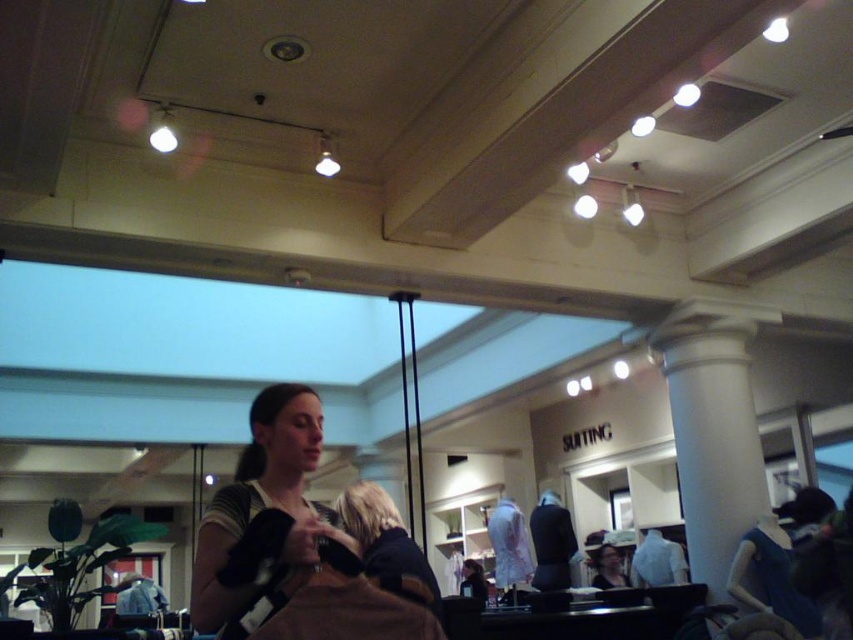
Question: Which of the following is the farthest from the observer?

Choices:
 (A) white smooth column at center
 (B) matte brown purse at center
 (C) blonde hair at center

Answer: (A)

Question: Which point is farther to the camera?

Choices:
 (A) blonde hair at center
 (B) white smooth column at center
 (C) matte brown purse at center

Answer: (B)

Question: Which of the following is the farthest from the observer?

Choices:
 (A) (312, 401)
 (B) (367, 540)

Answer: (B)

Question: Is white smooth column at center wider than blonde hair at center?

Choices:
 (A) no
 (B) yes

Answer: (B)

Question: Is matte brown purse at center positioned before blonde hair at center?

Choices:
 (A) yes
 (B) no

Answer: (A)

Question: Observing the image, what is the correct spatial positioning of matte brown purse at center in reference to blonde hair at center?

Choices:
 (A) below
 (B) above

Answer: (B)